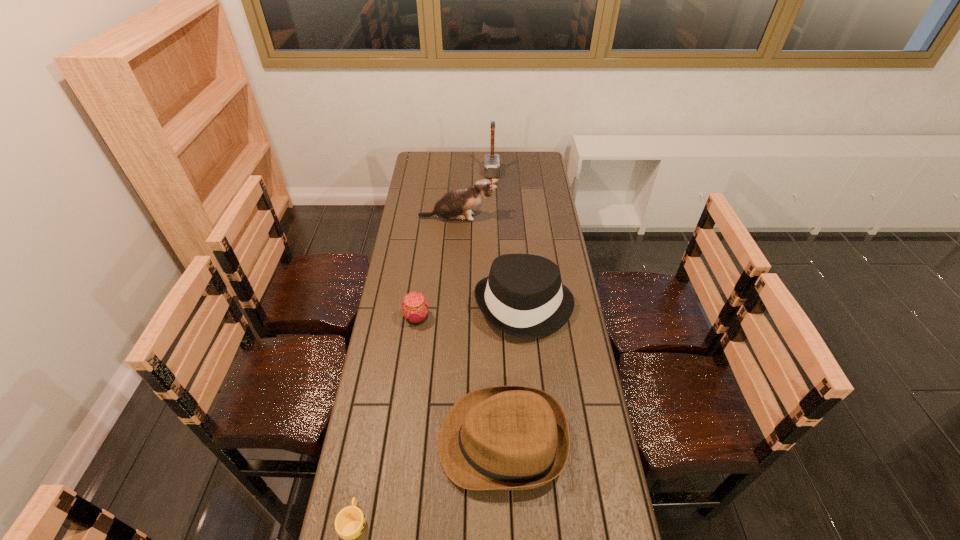
Image resolution: width=960 pixels, height=540 pixels. In the image, there is a desktop. Identify the location of vacant space at the left edge. (392, 345).

This screenshot has height=540, width=960. What are the coordinates of `vacant space at the right edge` in the screenshot? It's located at (578, 319).

The height and width of the screenshot is (540, 960). I want to click on free region at the far left corner of the desktop, so click(x=411, y=174).

This screenshot has width=960, height=540. Identify the location of free space at the far right corner. (527, 160).

Locate an element on the screen. The width and height of the screenshot is (960, 540). vacant area that lies between the cat and the third shortest object is located at coordinates (480, 330).

Identify the location of vacant point located between the second shortest object and the taller fedora. The width and height of the screenshot is (960, 540). (471, 312).

Locate an element on the screen. The image size is (960, 540). free spot between the cat and the jam is located at coordinates (438, 268).

Identify the location of object identified as the fourth closest to the cat. (505, 437).

Where is `object that is the third closest one to the farther fedora`? The image size is (960, 540). object that is the third closest one to the farther fedora is located at coordinates (457, 204).

Locate an element on the screen. blank area in the image that satisfies the following two spatial constraints: 1. on the back side of the taller fedora; 2. on the striking surface of the farthest object is located at coordinates (513, 172).